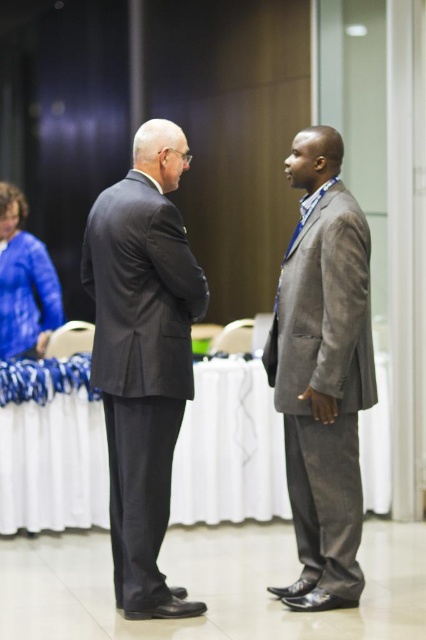
You are standing in the room and want to move from point A to point B. Point A is at coordinates point (x=345, y=586) and point B is at coordinates point (x=28, y=236). Which point is closer to you when you first enter the room?

Point (x=345, y=586) is closer to the viewer than point (x=28, y=236). So, point A is closer to you when you first enter the room.